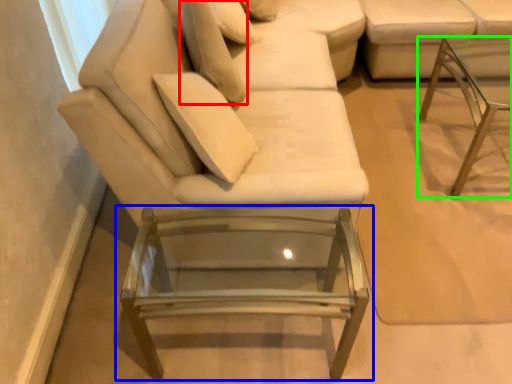
Question: Estimate the real-world distances between objects in this image. Which object is farther from pillow (highlighted by a red box), table (highlighted by a blue box) or table (highlighted by a green box)?

Choices:
 (A) table
 (B) table

Answer: (B)